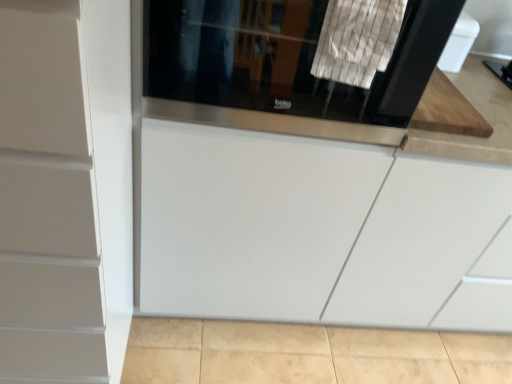
Question: Can you confirm if black glass screen door at upper center is bigger than white matte cabinet at left?

Choices:
 (A) yes
 (B) no

Answer: (B)

Question: From the image's perspective, is black glass screen door at upper center over white matte cabinet at left?

Choices:
 (A) yes
 (B) no

Answer: (A)

Question: Is the depth of black glass screen door at upper center greater than that of white matte cabinet at left?

Choices:
 (A) no
 (B) yes

Answer: (B)

Question: Does black glass screen door at upper center have a lesser height compared to white matte cabinet at left?

Choices:
 (A) no
 (B) yes

Answer: (B)

Question: Is black glass screen door at upper center not near white matte cabinet at left?

Choices:
 (A) no
 (B) yes

Answer: (A)

Question: Is black glass screen door at upper center facing towards white matte cabinet at left?

Choices:
 (A) no
 (B) yes

Answer: (A)

Question: Can you confirm if black glass screen door at upper center is smaller than white striped fabric at upper center?

Choices:
 (A) yes
 (B) no

Answer: (B)

Question: Does black glass screen door at upper center have a larger size compared to white striped fabric at upper center?

Choices:
 (A) no
 (B) yes

Answer: (B)

Question: From a real-world perspective, is black glass screen door at upper center physically below white striped fabric at upper center?

Choices:
 (A) yes
 (B) no

Answer: (A)

Question: Can white striped fabric at upper center be found inside black glass screen door at upper center?

Choices:
 (A) no
 (B) yes

Answer: (B)

Question: Does black glass screen door at upper center turn towards white striped fabric at upper center?

Choices:
 (A) yes
 (B) no

Answer: (A)

Question: Considering the relative positions of black glass screen door at upper center and white striped fabric at upper center in the image provided, is black glass screen door at upper center to the left of white striped fabric at upper center from the viewer's perspective?

Choices:
 (A) yes
 (B) no

Answer: (A)

Question: Is white striped fabric at upper center closer to the viewer compared to black glass screen door at upper center?

Choices:
 (A) yes
 (B) no

Answer: (A)